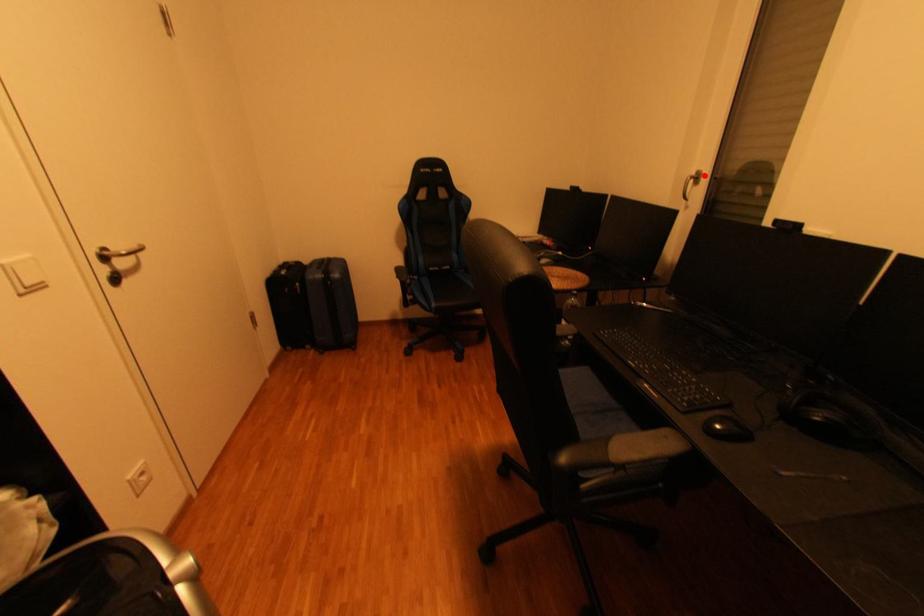
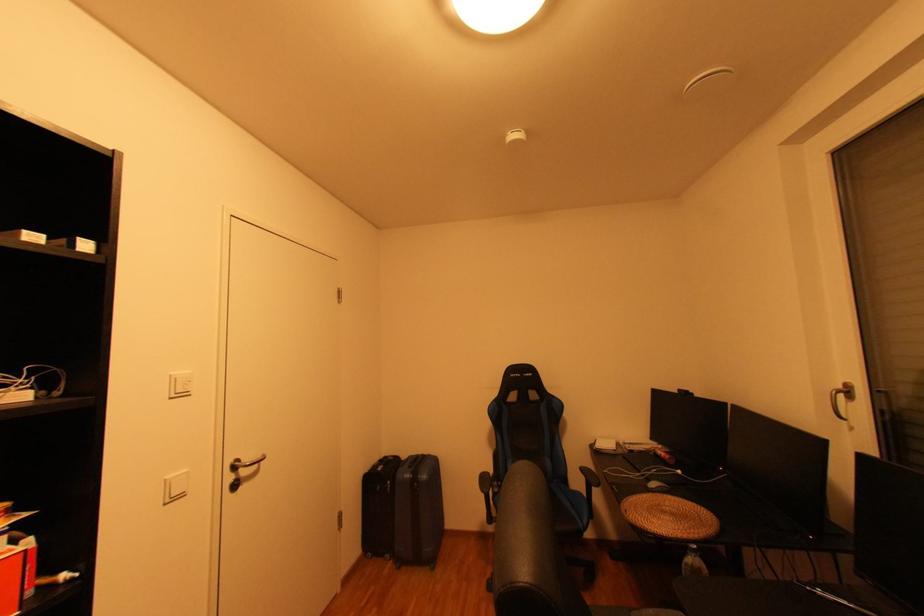
Find the pixel in the second image that matches the highlighted location in the first image.

(849, 387)